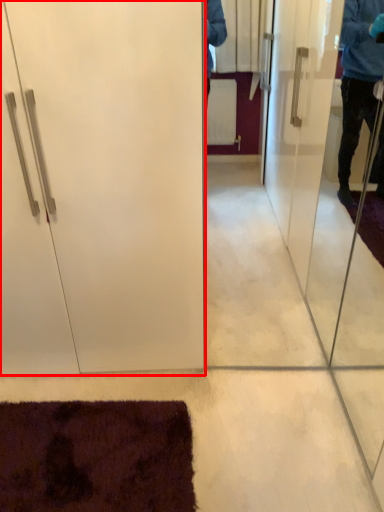
Question: Observing the image, what is the correct spatial positioning of door (annotated by the red box) in reference to screen door?

Choices:
 (A) right
 (B) left

Answer: (B)